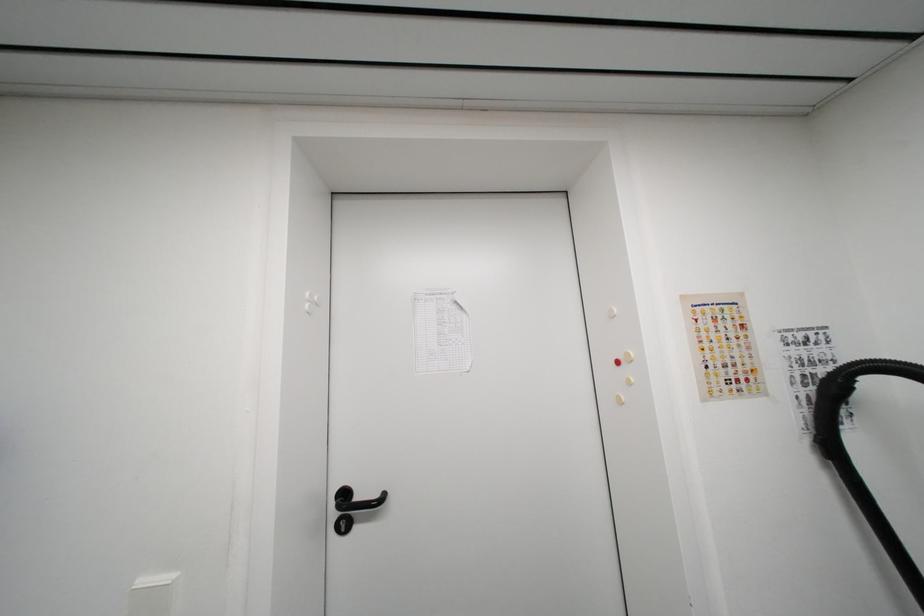
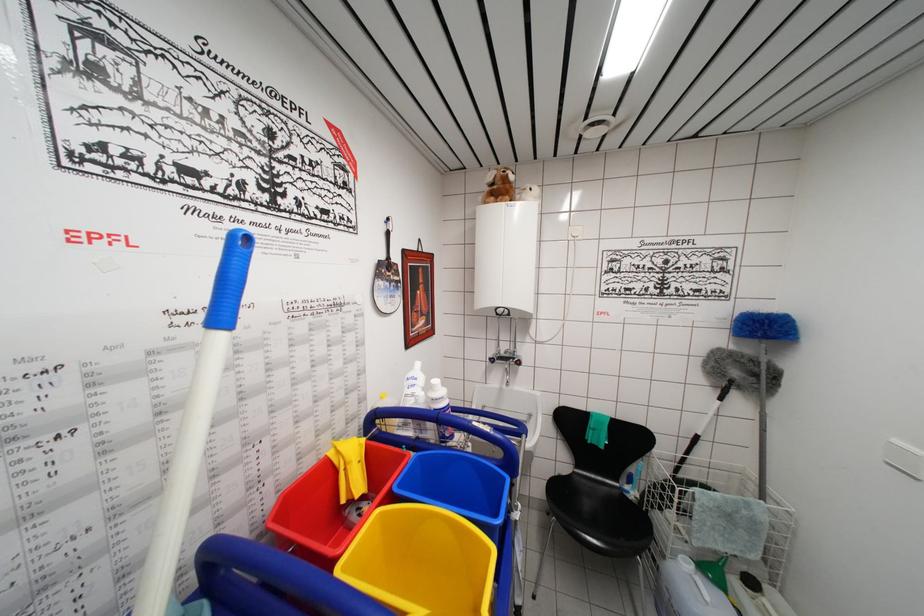
Question: The first image is from the beginning of the video and the second image is from the end. How did the camera likely rotate when shooting the video?

Choices:
 (A) Left
 (B) Right
 (C) Up
 (D) Down

Answer: (A)